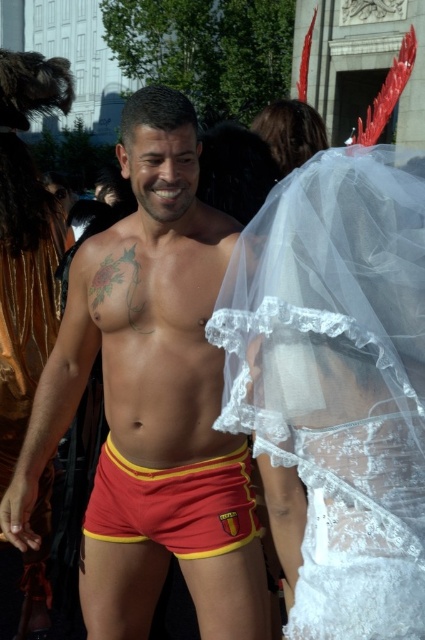
You are a photographer at this event. You want to capture a shot where both the white lace veil at upper center and the matte red shorts at center are clearly visible. Based on their positions, which object should you focus on first to ensure both are in sharp focus?

You should focus on the white lace veil at upper center first since it is closer to the viewer than the matte red shorts at center. By focusing on the closer object, the depth of field may naturally include the farther object in acceptable focus.

Please describe the exact position of the matte red shorts at center in the image using coordinates. The answer should include the coordinates provided in the Objects Description.

The matte red shorts at center are located at coordinates point [139,316].